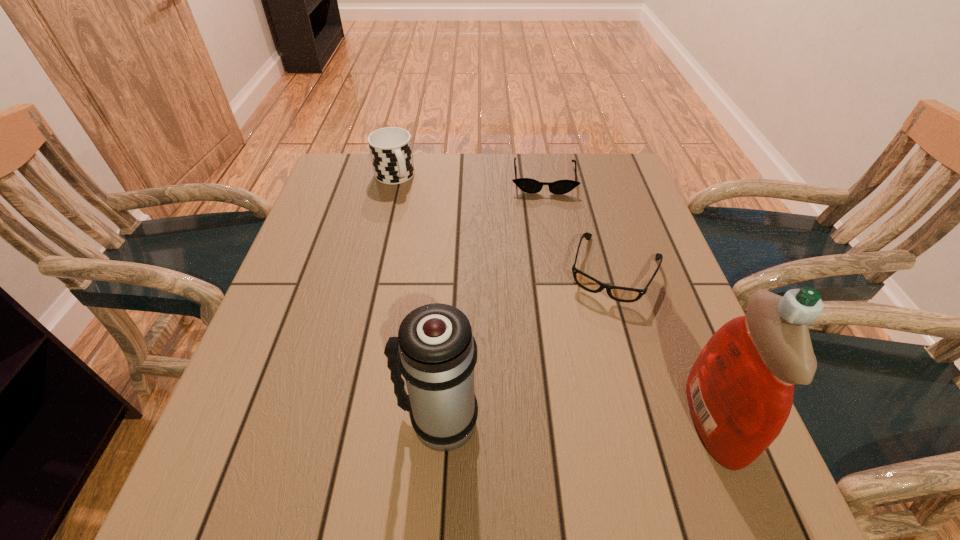
Identify the location of free space on the desktop that is between the second object from left to right and the tallest object and is positioned on the front-facing side of the shortest object. Image resolution: width=960 pixels, height=540 pixels. (555, 421).

Find the location of a particular element. This screenshot has width=960, height=540. vacant space on the desktop that is between the thermos bottle and the tallest object and is positioned on the side of the leftmost object with the handle is located at coordinates (552, 421).

The height and width of the screenshot is (540, 960). What are the coordinates of `vacant space on the desktop that is between the second tallest object and the tallest object and is positioned on the front-facing side of the spectacles` in the screenshot? It's located at (556, 421).